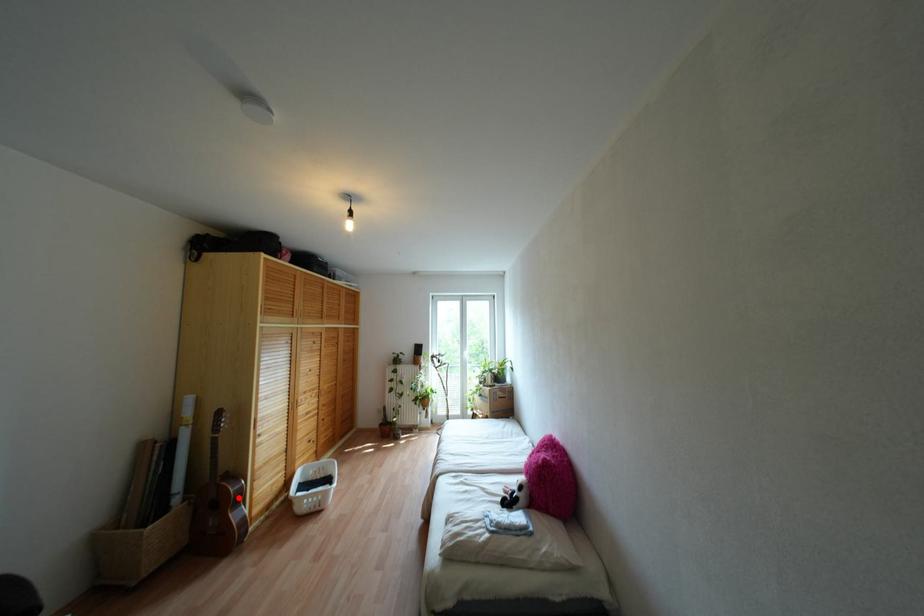
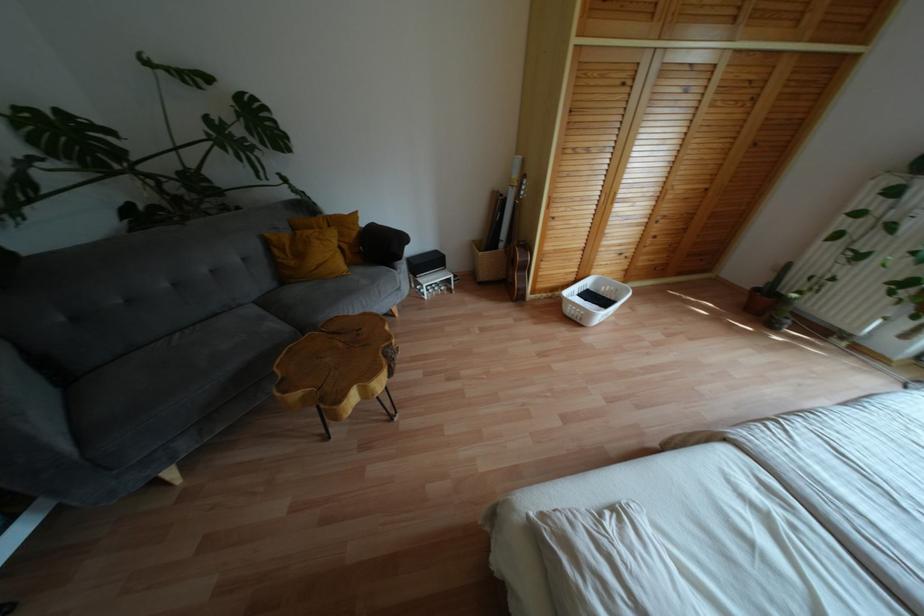
Locate, in the second image, the point that corresponds to the highlighted location in the first image.

(525, 267)